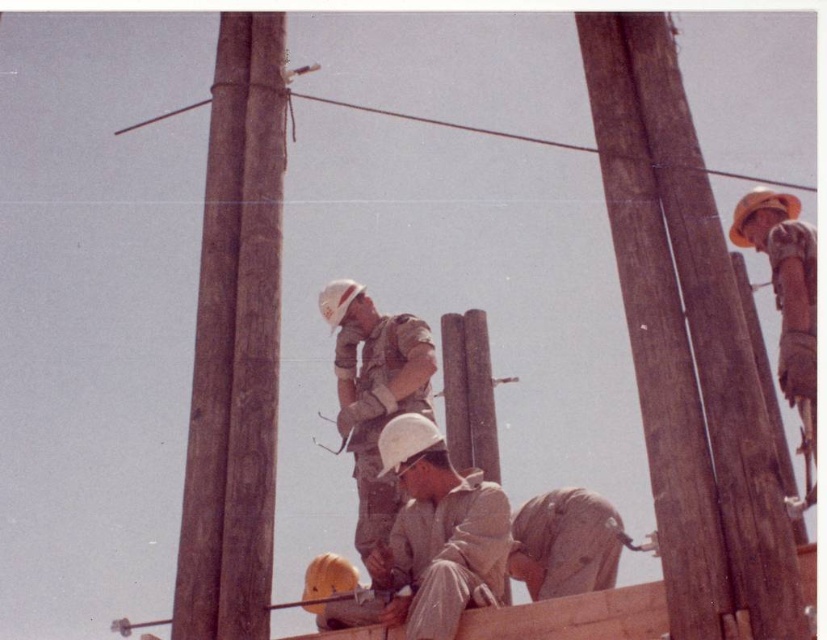
Question: Which of these objects is positioned farthest from the camouflage fabric soldier at center?

Choices:
 (A) brown wooden telegraph pole at right
 (B) brown wood telegraph pole at left

Answer: (A)

Question: Can you confirm if brown wooden telegraph pole at right is positioned above matte white helmet at center?

Choices:
 (A) yes
 (B) no

Answer: (A)

Question: Does brown wood telegraph pole at left have a smaller size compared to matte white helmet at center?

Choices:
 (A) no
 (B) yes

Answer: (B)

Question: Does brown wooden telegraph pole at right have a lesser width compared to camouflage fabric soldier at center?

Choices:
 (A) no
 (B) yes

Answer: (B)

Question: Which point is farther from the camera taking this photo?

Choices:
 (A) (600, 116)
 (B) (354, 356)
 (C) (433, 509)
 (D) (214, 608)

Answer: (B)

Question: Which point is farther to the camera?

Choices:
 (A) (x=443, y=456)
 (B) (x=204, y=500)
 (C) (x=677, y=525)
 (D) (x=366, y=481)

Answer: (D)